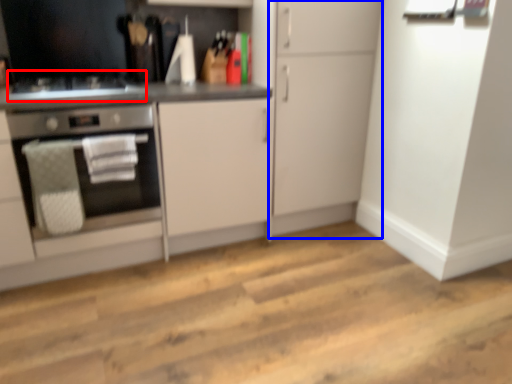
Question: Among these objects, which one is nearest to the camera, gas stove (highlighted by a red box) or cabinetry (highlighted by a blue box)?

Choices:
 (A) gas stove
 (B) cabinetry

Answer: (A)